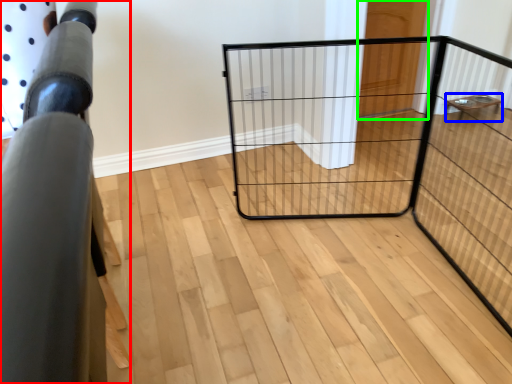
Question: Based on their relative distances, which object is nearer to furniture (highlighted by a red box)? Choose from furniture (highlighted by a blue box) and door (highlighted by a green box).

Choices:
 (A) furniture
 (B) door

Answer: (B)